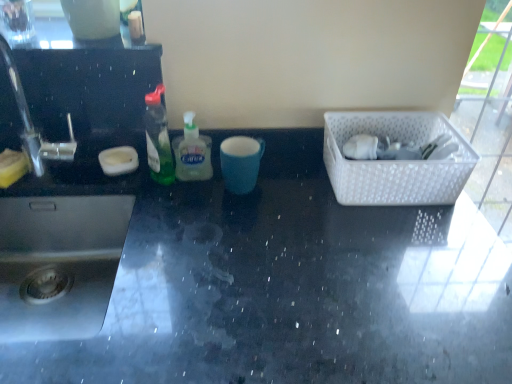
I want to click on vacant space in front of translucent green liquid soap at center, marked as the first bottle in a right-to-left arrangement, so click(x=193, y=218).